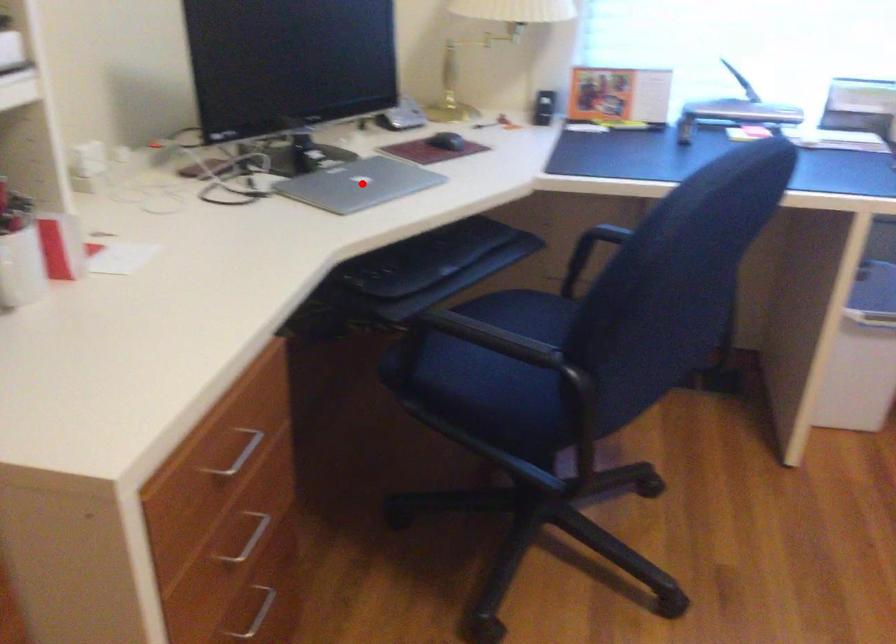
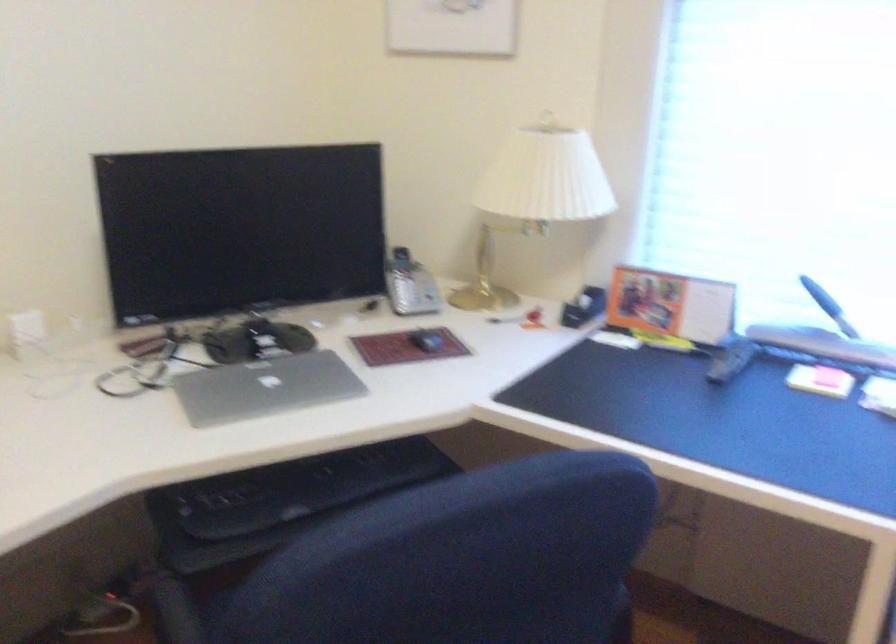
Where in the second image is the point corresponding to the highlighted location from the first image?

(264, 386)